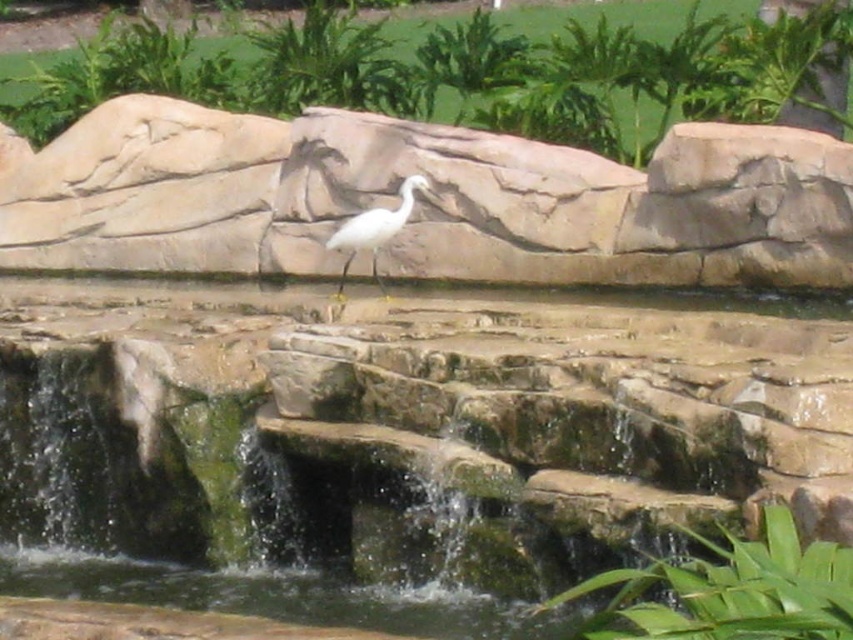
Is smooth stone wall at center to the left of white smooth bird at center from the viewer's perspective?

Yes, smooth stone wall at center is to the left of white smooth bird at center.

Is smooth stone wall at center thinner than white smooth bird at center?

In fact, smooth stone wall at center might be wider than white smooth bird at center.

Is point (352, 131) more distant than point (328, 241)?

Yes, it is behind point (328, 241).

This screenshot has height=640, width=853. Find the location of `smooth stone wall at center`. smooth stone wall at center is located at coordinates (427, 200).